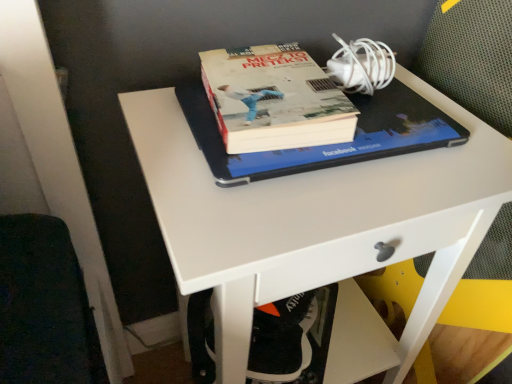
Where is `hardcover book at center`? hardcover book at center is located at coordinates (274, 99).

The image size is (512, 384). In order to click on white plastic swivel chair at lower center in this screenshot , I will do `click(292, 338)`.

Where is `hardcover book at center`? This screenshot has height=384, width=512. hardcover book at center is located at coordinates (327, 145).

Locate an element on the screen. hardcover book at center is located at coordinates (274, 99).

What's the angular difference between hardcover book at center and white matte desk at center's facing directions?

2.58 degrees.

Consider the image. Does hardcover book at center have a greater width compared to white matte desk at center?

In fact, hardcover book at center might be narrower than white matte desk at center.

From the image's perspective, which one is positioned lower, hardcover book at center or white matte desk at center?

white matte desk at center.

Measure the distance between hardcover book at center and white matte desk at center.

They are 9.64 centimeters apart.

Does white matte desk at center come in front of hardcover book at center?

That is True.

Considering the sizes of white matte desk at center and hardcover book at center in the image, is white matte desk at center wider or thinner than hardcover book at center?

In the image, white matte desk at center appears to be wider than hardcover book at center.

Is white matte desk at center not close to hardcover book at center?

Actually, white matte desk at center and hardcover book at center are a little close together.

Is white matte desk at center positioned beyond the bounds of hardcover book at center?

Yes, white matte desk at center is located beyond the bounds of hardcover book at center.

Considering the relative sizes of hardcover book at center and white plastic swivel chair at lower center in the image provided, is hardcover book at center thinner than white plastic swivel chair at lower center?

Yes.

Measure the distance from hardcover book at center to white plastic swivel chair at lower center.

They are 15.29 inches apart.

Is hardcover book at center positioned with its back to white plastic swivel chair at lower center?

No, white plastic swivel chair at lower center is not at the back of hardcover book at center.

Can you confirm if hardcover book at center is shorter than white plastic swivel chair at lower center?

Yes.

From the image's perspective, is white plastic swivel chair at lower center above hardcover book at center?

No.

Which of these two, white plastic swivel chair at lower center or hardcover book at center, stands taller?

Answer: white plastic swivel chair at lower center is taller.

Considering the sizes of white plastic swivel chair at lower center and hardcover book at center in the image, is white plastic swivel chair at lower center wider or thinner than hardcover book at center?

Clearly, white plastic swivel chair at lower center has less width compared to hardcover book at center.

Identify the location of book that appears above the hardcover book at center (from a real-world perspective). (274, 99).

Is hardcover book at center bigger or smaller than hardcover book at center?

Considering their sizes, hardcover book at center takes up more space than hardcover book at center.

Is hardcover book at center in contact with hardcover book at center?

Yes, hardcover book at center is right next to hardcover book at center and making contact.

Locate an element on the screen. This screenshot has height=384, width=512. notebook located on the right of white matte desk at center is located at coordinates (327, 145).

Is hardcover book at center completely or partially inside white matte desk at center?

No, hardcover book at center is located outside of white matte desk at center.

From the image's perspective, which object appears higher, white matte desk at center or hardcover book at center?

hardcover book at center, from the image's perspective.

In the scene shown: Is white matte desk at center aimed at hardcover book at center?

No, white matte desk at center is not aimed at hardcover book at center.

Is white matte desk at center a part of white plastic swivel chair at lower center?

No, white plastic swivel chair at lower center does not contain white matte desk at center.

Is white plastic swivel chair at lower center bigger than white matte desk at center?

Incorrect, white plastic swivel chair at lower center is not larger than white matte desk at center.

From a real-world perspective, which is physically above, white plastic swivel chair at lower center or white matte desk at center?

From a 3D spatial view, white matte desk at center is above.

Identify the location of notebook on the right of white matte desk at center. The image size is (512, 384). (327, 145).

Where is `desk located in front of the hardcover book at center`? desk located in front of the hardcover book at center is located at coordinates pos(318,221).

Based on their spatial positions, is white plastic swivel chair at lower center or hardcover book at center closer to white matte desk at center?

Among the two, hardcover book at center is located nearer to white matte desk at center.

Looking at this image, looking at the image, which one is located further to white matte desk at center, hardcover book at center or white plastic swivel chair at lower center?

white plastic swivel chair at lower center lies further to white matte desk at center than the other object.

Considering their positions, is white matte desk at center positioned closer to hardcover book at center than hardcover book at center?

Based on the image, hardcover book at center appears to be nearer to hardcover book at center.

From the image, which object appears to be nearer to white plastic swivel chair at lower center, hardcover book at center or hardcover book at center?

hardcover book at center lies closer to white plastic swivel chair at lower center than the other object.

Consider the image. When comparing their distances from white matte desk at center, does hardcover book at center or hardcover book at center seem further?

Based on the image, hardcover book at center appears to be further to white matte desk at center.

From the image, which object appears to be nearer to white plastic swivel chair at lower center, hardcover book at center or white matte desk at center?

Based on the image, white matte desk at center appears to be nearer to white plastic swivel chair at lower center.

When comparing their distances from white matte desk at center, does hardcover book at center or white plastic swivel chair at lower center seem further?

white plastic swivel chair at lower center lies further to white matte desk at center than the other object.

Based on their spatial positions, is white matte desk at center or hardcover book at center closer to white plastic swivel chair at lower center?

Based on the image, white matte desk at center appears to be nearer to white plastic swivel chair at lower center.

This screenshot has width=512, height=384. I want to click on desk between hardcover book at center and white plastic swivel chair at lower center in the up-down direction, so pyautogui.click(x=318, y=221).

Where is `notebook between hardcover book at center and white plastic swivel chair at lower center vertically`? The image size is (512, 384). notebook between hardcover book at center and white plastic swivel chair at lower center vertically is located at coordinates (327, 145).

I want to click on desk between hardcover book at center and white plastic swivel chair at lower center vertically, so click(x=318, y=221).

This screenshot has width=512, height=384. In order to click on notebook between hardcover book at center and white matte desk at center from top to bottom in this screenshot , I will do 327,145.